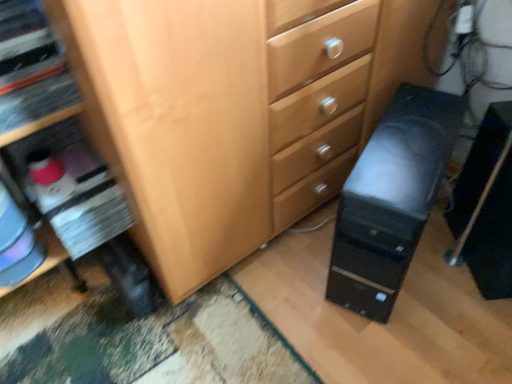
Question: Should I look upward or downward to see black plastic computer tower at lower right, the 2th computer tower positioned from the left?

Choices:
 (A) up
 (B) down

Answer: (B)

Question: Is black plastic computer tower at lower right, the 2th computer tower positioned from the left, not within black plastic computer tower at lower right, which is the first computer tower from left to right?

Choices:
 (A) yes
 (B) no

Answer: (A)

Question: Does black plastic computer tower at lower right, arranged as the 1th computer tower when viewed from the right, have a lesser height compared to black plastic computer tower at lower right, the second computer tower from the right?

Choices:
 (A) yes
 (B) no

Answer: (A)

Question: From the image's perspective, is black plastic computer tower at lower right, the 2th computer tower positioned from the left, over black plastic computer tower at lower right, which is the first computer tower from left to right?

Choices:
 (A) no
 (B) yes

Answer: (A)

Question: From the image's perspective, is black plastic computer tower at lower right, arranged as the 1th computer tower when viewed from the right, under black plastic computer tower at lower right, which is the first computer tower from left to right?

Choices:
 (A) yes
 (B) no

Answer: (A)

Question: Does black plastic computer tower at lower right, arranged as the 1th computer tower when viewed from the right, come behind black plastic computer tower at lower right, which is the first computer tower from left to right?

Choices:
 (A) no
 (B) yes

Answer: (B)

Question: Is black plastic computer tower at lower right, arranged as the 1th computer tower when viewed from the right, at the right side of black plastic computer tower at lower right, which is the first computer tower from left to right?

Choices:
 (A) no
 (B) yes

Answer: (B)

Question: Does black plastic computer tower at lower right, the second computer tower from the right, come behind black plastic computer tower at lower right, arranged as the 1th computer tower when viewed from the right?

Choices:
 (A) no
 (B) yes

Answer: (A)

Question: Can you confirm if black plastic computer tower at lower right, the second computer tower from the right, is thinner than black plastic computer tower at lower right, the 2th computer tower positioned from the left?

Choices:
 (A) no
 (B) yes

Answer: (A)

Question: Does black plastic computer tower at lower right, which is the first computer tower from left to right, have a greater height compared to black plastic computer tower at lower right, the 2th computer tower positioned from the left?

Choices:
 (A) no
 (B) yes

Answer: (B)

Question: Is black plastic computer tower at lower right, the second computer tower from the right, bigger than black plastic computer tower at lower right, the 2th computer tower positioned from the left?

Choices:
 (A) yes
 (B) no

Answer: (A)

Question: From the image's perspective, does black plastic computer tower at lower right, which is the first computer tower from left to right, appear lower than black plastic computer tower at lower right, arranged as the 1th computer tower when viewed from the right?

Choices:
 (A) no
 (B) yes

Answer: (A)

Question: Is black plastic computer tower at lower right, which is the first computer tower from left to right, next to black plastic computer tower at lower right, the 2th computer tower positioned from the left?

Choices:
 (A) yes
 (B) no

Answer: (B)

Question: Is black plastic computer tower at lower right, the 2th computer tower positioned from the left, taller or shorter than black plastic computer tower at lower right, the second computer tower from the right?

Choices:
 (A) tall
 (B) short

Answer: (B)